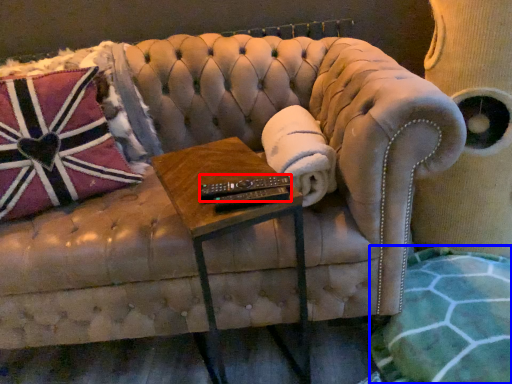
Question: Which object is closer to the camera taking this photo, control (highlighted by a red box) or blanket (highlighted by a blue box)?

Choices:
 (A) control
 (B) blanket

Answer: (B)